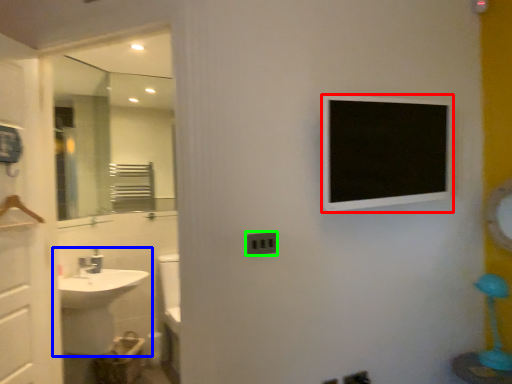
Question: Which object is the closest to the medicine cabinet (highlighted by a red box)? Choose among these: sink (highlighted by a blue box) or electric outlet (highlighted by a green box).

Choices:
 (A) sink
 (B) electric outlet

Answer: (B)